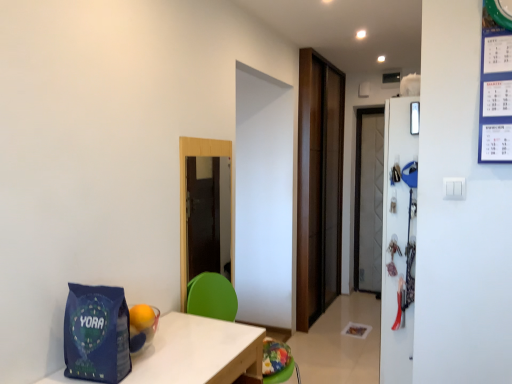
This screenshot has width=512, height=384. Identify the location of vacant region under brown wood door at center (from a real-world perspective). (324, 312).